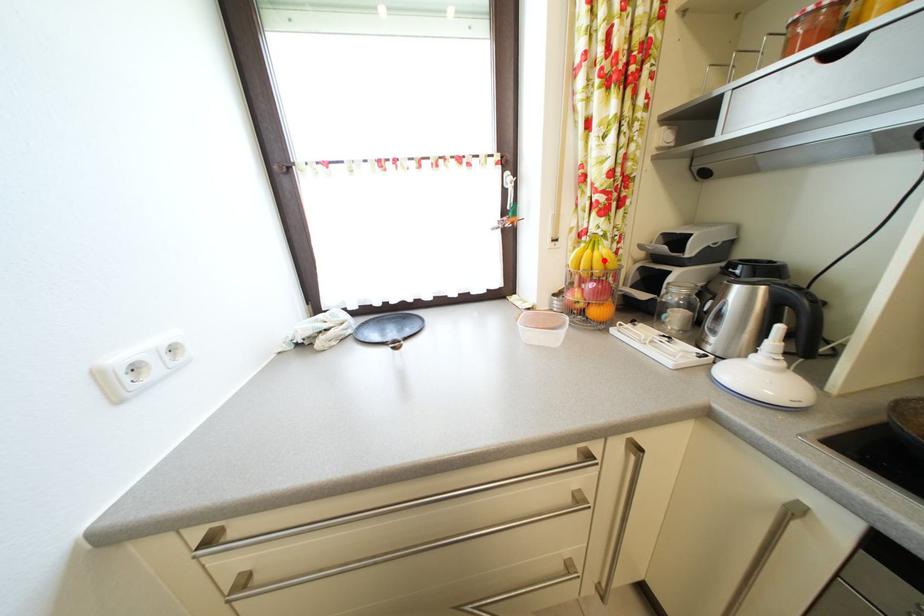
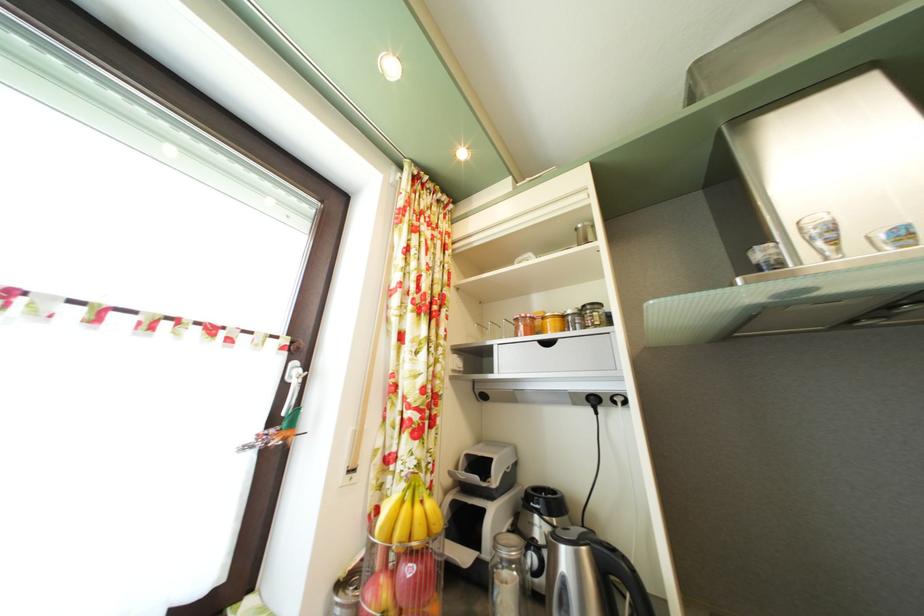
Where in the second image is the point corresponding to the highlighted location from the first image?

(426, 516)